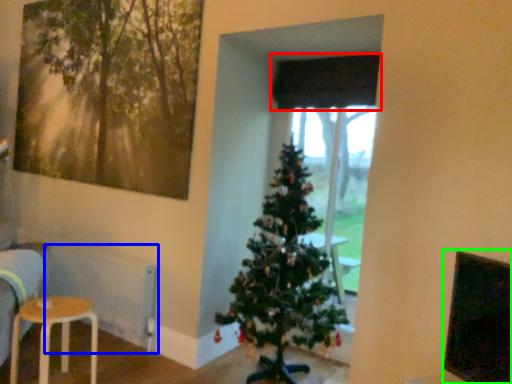
Question: Which object is the closest to the curtain (highlighted by a red box)? Choose among these: radiator (highlighted by a blue box) or window screen (highlighted by a green box).

Choices:
 (A) radiator
 (B) window screen

Answer: (B)